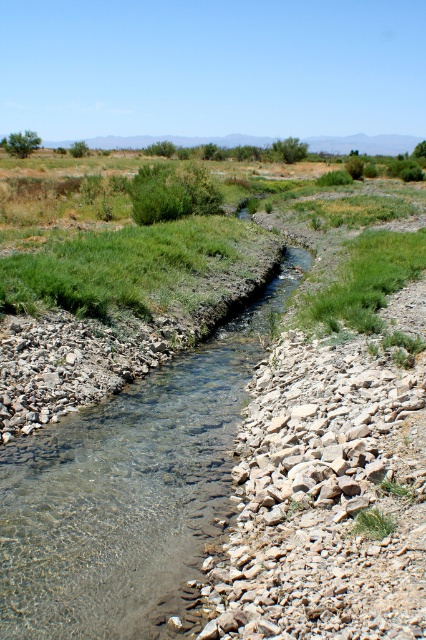
You are a hiker who needs to cross the clear water stream at center. There is a green leafy bush at upper left nearby. Which direction should you look to see the bush from the stream?

The green leafy bush at upper left is above the clear water stream at center, so you should look upward from the stream to see the bush.

You are a hiker trying to cross the clear water stream at center. You notice a green leafy bush at upper left nearby. Which one is narrower in width?

The clear water stream at center is narrower than the green leafy bush at upper left.

You are standing at the edge of the stream and want to reach a point that is closer to you. Which point should you head towards, point (46,516) or point (11,140)?

Point (46,516) is closer to the viewer than point (11,140), so you should head towards point (46,516).